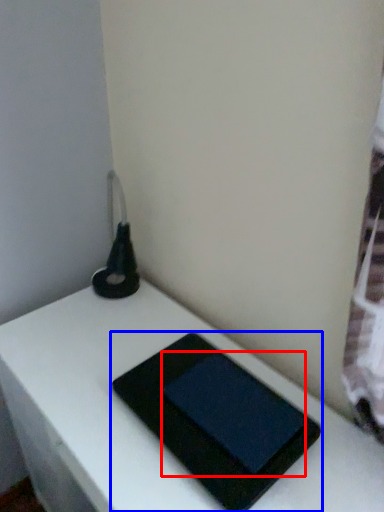
Question: Which object is further to the camera taking this photo, tablet computer (highlighted by a red box) or tablet computer (highlighted by a blue box)?

Choices:
 (A) tablet computer
 (B) tablet computer

Answer: (A)